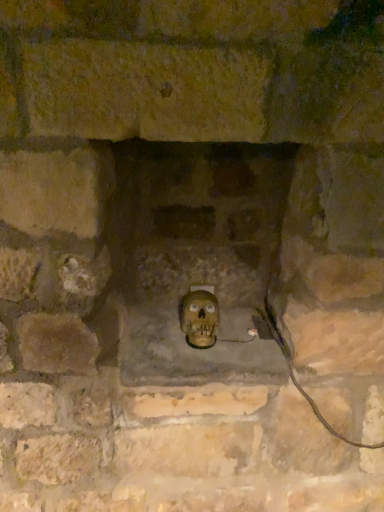
Image resolution: width=384 pixels, height=512 pixels. Identify the location of unoccupied region to the right of matte brown skull at center. (255, 339).